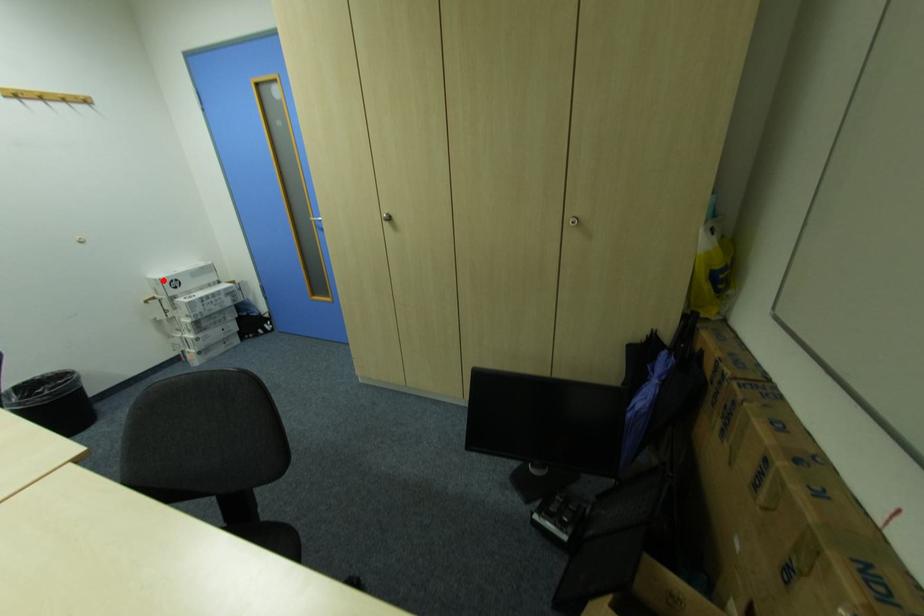
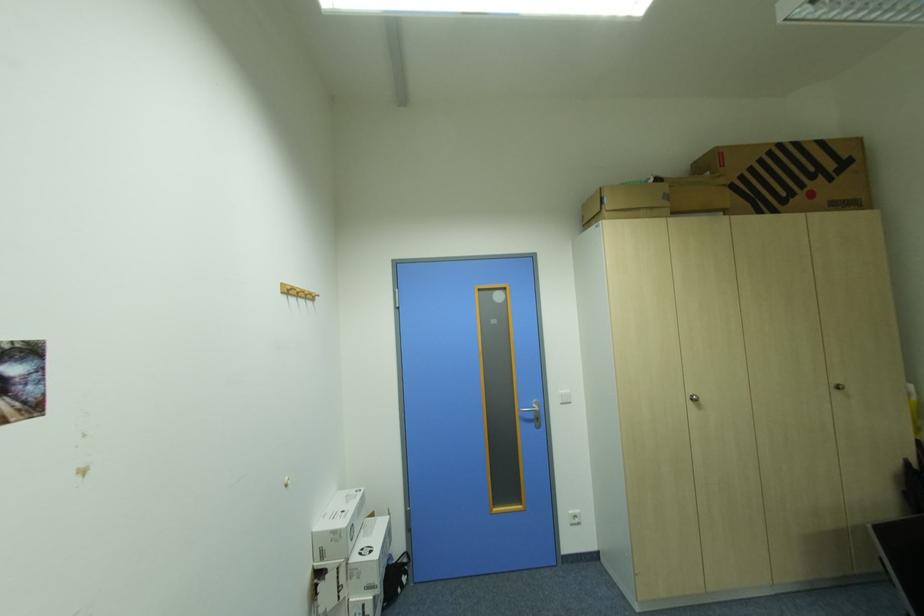
Where in the second image is the point corresponding to the highlighted location from the first image?

(341, 533)